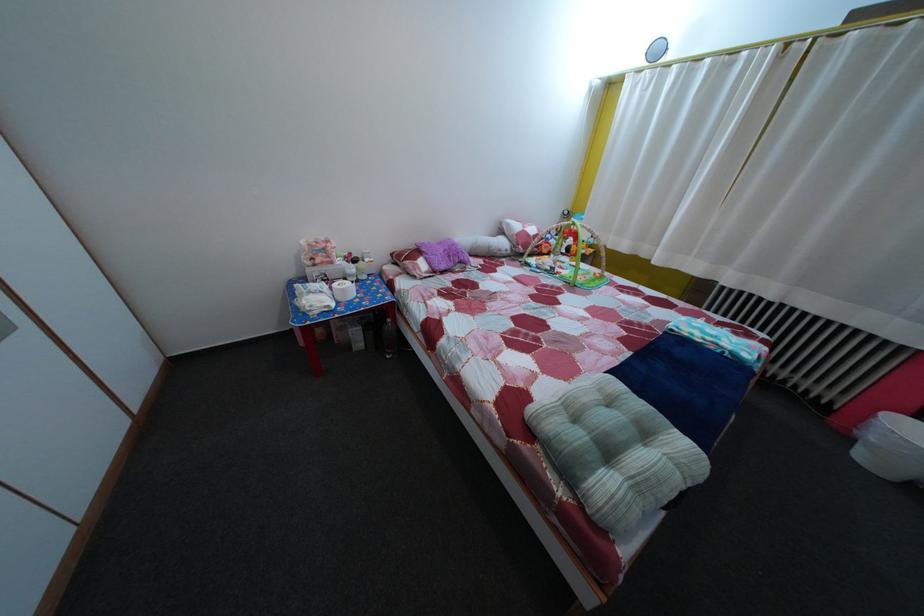
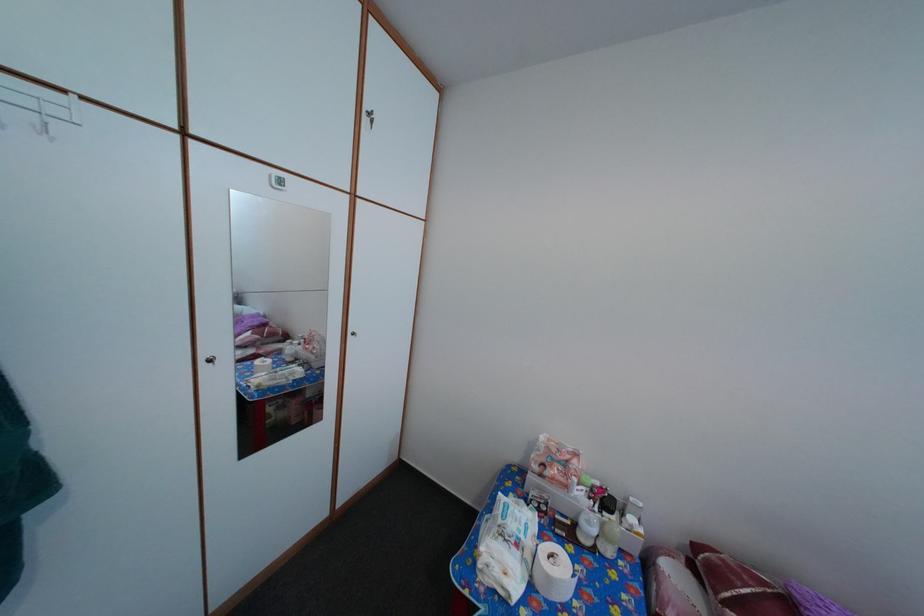
Locate, in the second image, the point that corresponds to [353,299] in the first image.

(558, 586)